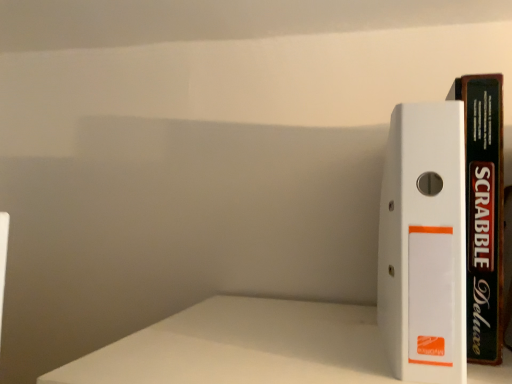
Question: From the image's perspective, is black matte scrabble deluxe at right, the 2th book in the left-to-right sequence, above or below white plastic binder at right, the 2th book positioned from the right?

Choices:
 (A) below
 (B) above

Answer: (B)

Question: Is black matte scrabble deluxe at right, which is counted as the first book, starting from the right, wider or thinner than white plastic binder at right, which is counted as the first book, starting from the left?

Choices:
 (A) wide
 (B) thin

Answer: (B)

Question: Based on their positions, is black matte scrabble deluxe at right, the 2th book in the left-to-right sequence, located to the left or right of white plastic binder at right, the 2th book positioned from the right?

Choices:
 (A) right
 (B) left

Answer: (A)

Question: Considering the positions of white plastic binder at right, which is counted as the first book, starting from the left, and black matte scrabble deluxe at right, the 2th book in the left-to-right sequence, in the image, is white plastic binder at right, which is counted as the first book, starting from the left, wider or thinner than black matte scrabble deluxe at right, the 2th book in the left-to-right sequence,?

Choices:
 (A) thin
 (B) wide

Answer: (B)

Question: Is white plastic binder at right, the 2th book positioned from the right, taller or shorter than black matte scrabble deluxe at right, the 2th book in the left-to-right sequence?

Choices:
 (A) short
 (B) tall

Answer: (A)

Question: Considering the positions of point (449, 172) and point (467, 155), is point (449, 172) closer or farther from the camera than point (467, 155)?

Choices:
 (A) farther
 (B) closer

Answer: (B)

Question: Is white plastic binder at right, the 2th book positioned from the right, situated inside black matte scrabble deluxe at right, which is counted as the first book, starting from the right, or outside?

Choices:
 (A) inside
 (B) outside

Answer: (B)